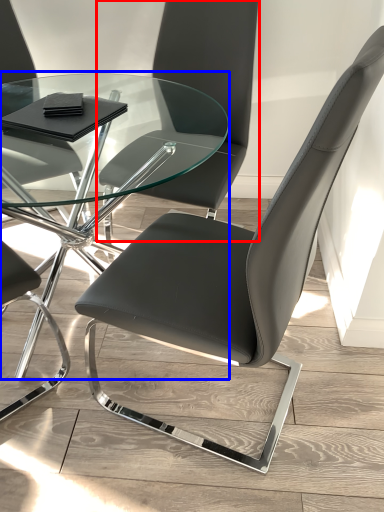
Question: Which of the following is the closest to the observer, chair (highlighted by a red box) or table (highlighted by a blue box)?

Choices:
 (A) chair
 (B) table

Answer: (B)